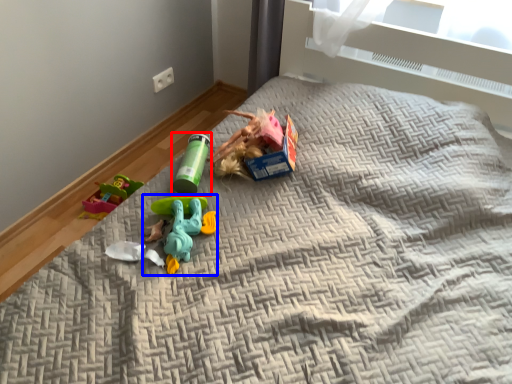
Question: Among these objects, which one is farthest to the camera, toy (highlighted by a red box) or toy (highlighted by a blue box)?

Choices:
 (A) toy
 (B) toy

Answer: (A)